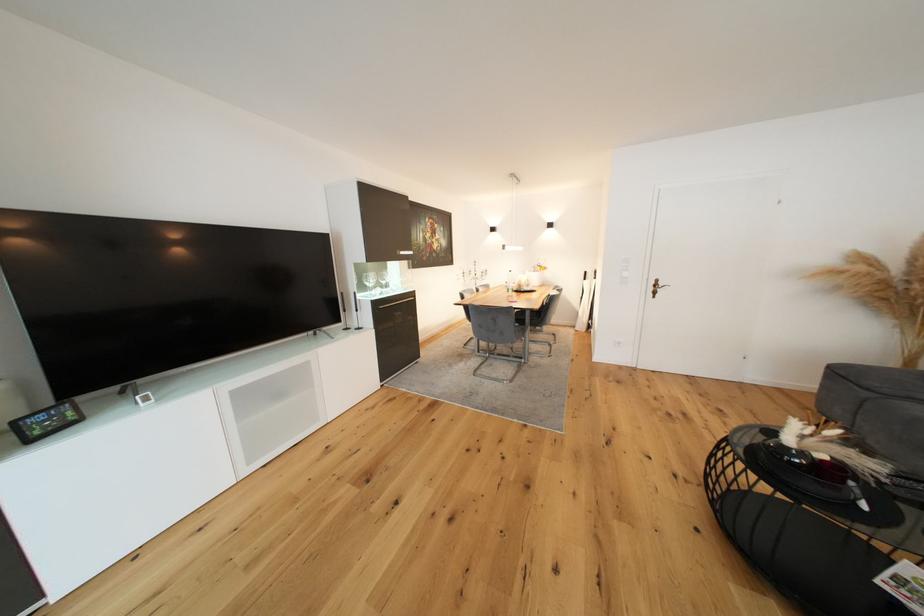
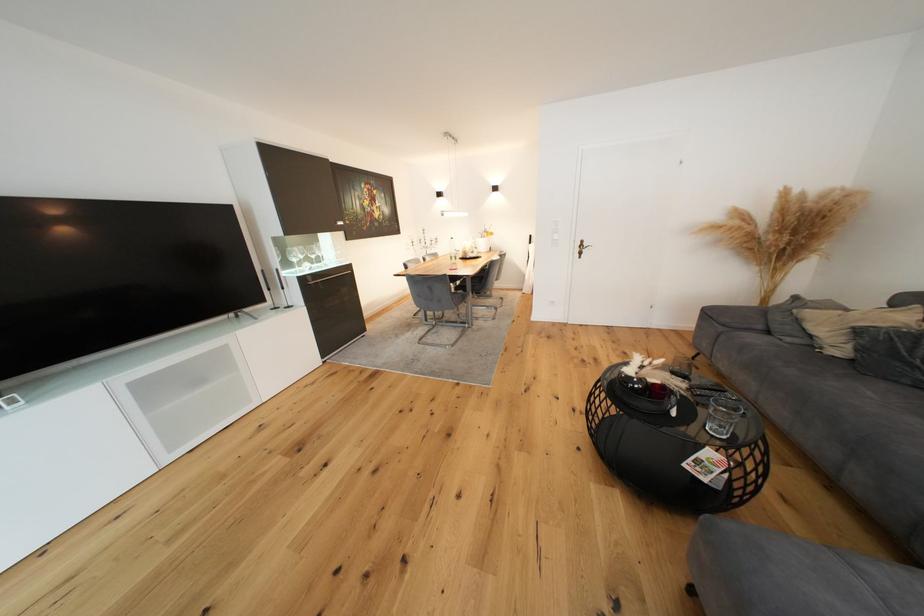
Where in the second image is the point corresponding to the point at 792,450 from the first image?

(637, 379)